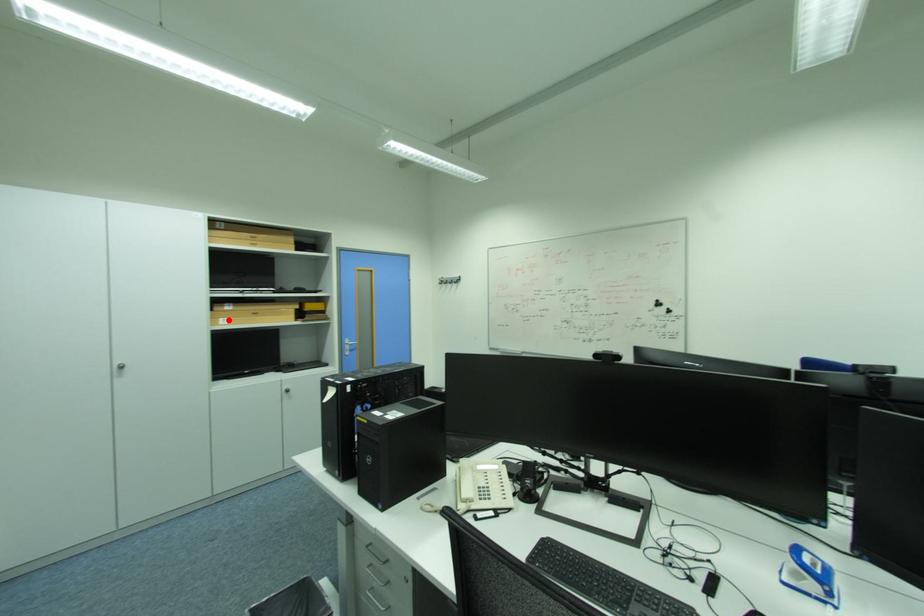
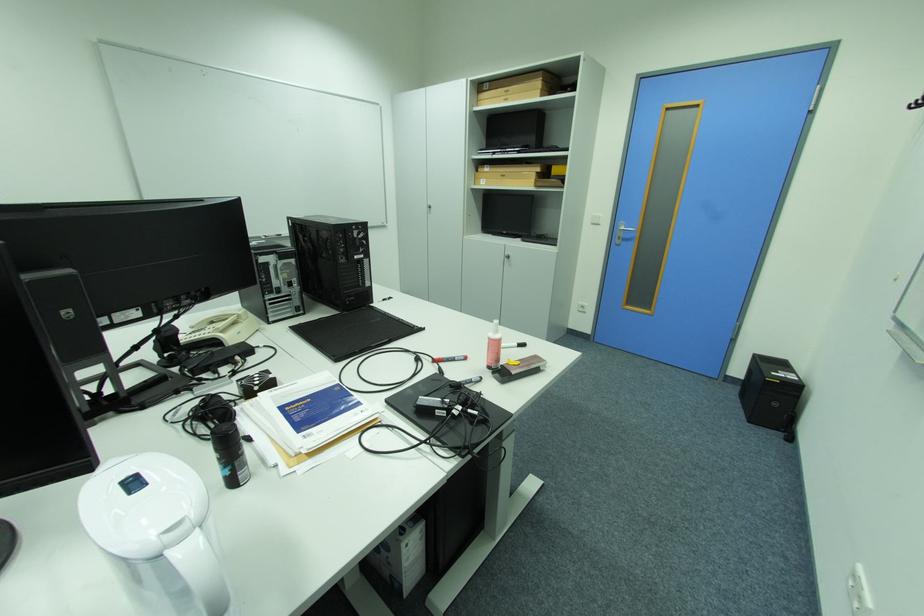
Where in the second image is the point corresponding to the highlighted location from the first image?

(490, 180)